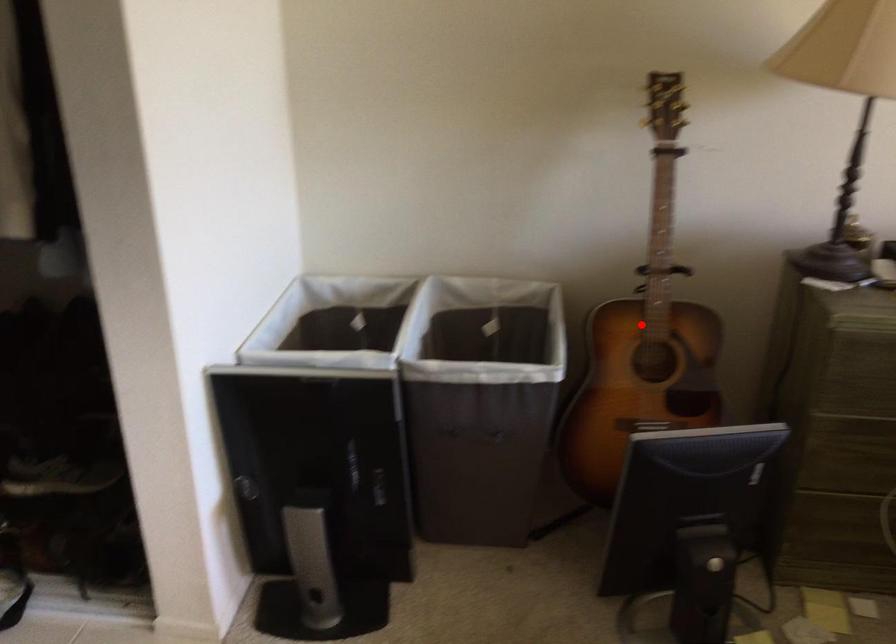
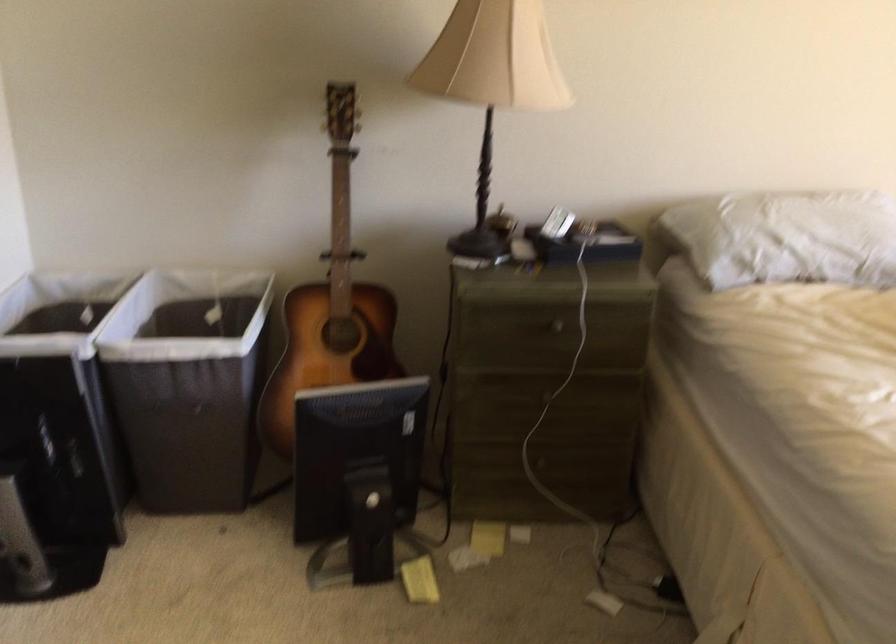
Question: I am providing you with two images of the same scene from different viewpoints. In image1, a red point is highlighted. Considering the same 3D point in image2, which of the following is correct?

Choices:
 (A) It is closer
 (B) It is farther

Answer: (B)